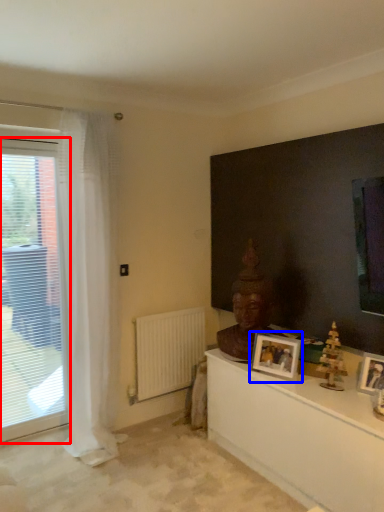
Question: Among these objects, which one is nearest to the camera, window (highlighted by a red box) or picture frame (highlighted by a blue box)?

Choices:
 (A) window
 (B) picture frame

Answer: (B)